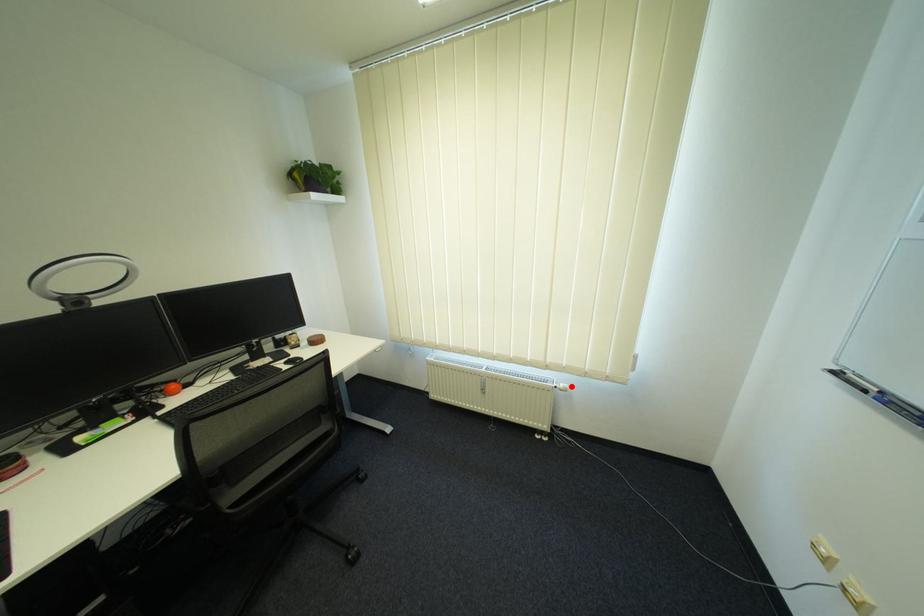
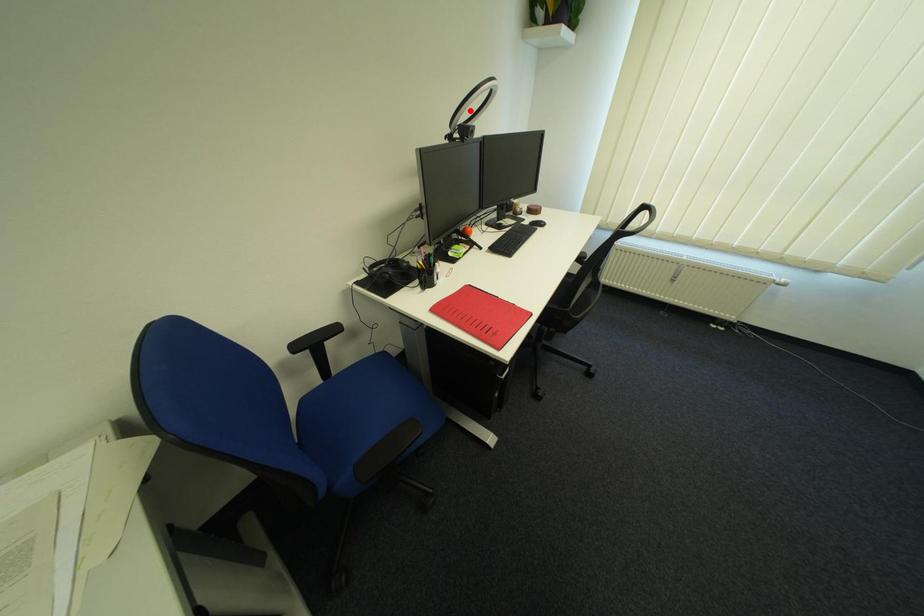
I am providing you with two images of the same scene from different viewpoints. A red point is marked on the first image and another point is marked on the second image. Is the marked point in image1 the same physical position as the marked point in image2?

No